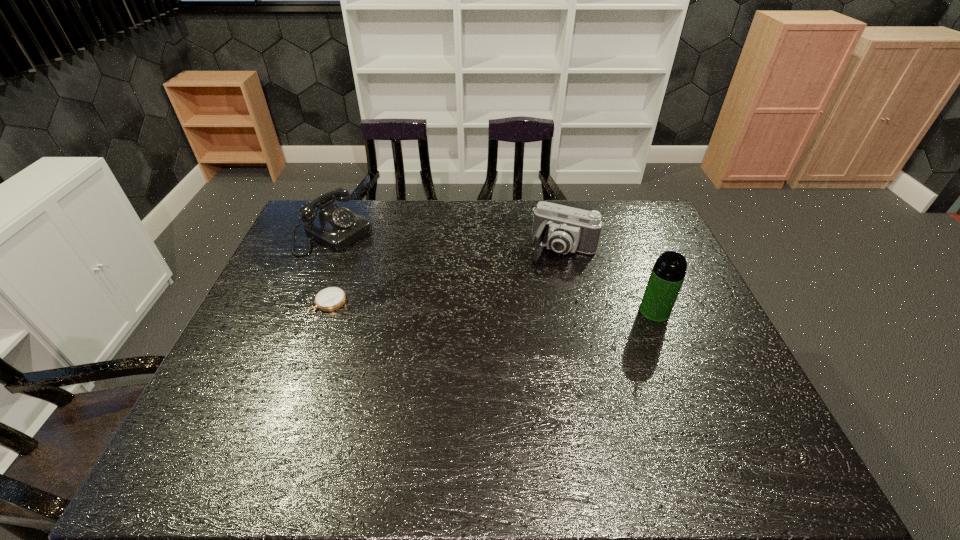
Where is `vacant space on the desktop that is between the shortest object and the tallest object and is positioned at the front of the third object from left to right with an open lens cover`? The height and width of the screenshot is (540, 960). vacant space on the desktop that is between the shortest object and the tallest object and is positioned at the front of the third object from left to right with an open lens cover is located at coordinates (538, 308).

Locate an element on the screen. The image size is (960, 540). free spot on the desktop that is between the compass and the rightmost object and is positioned on the dial of the telephone is located at coordinates (464, 306).